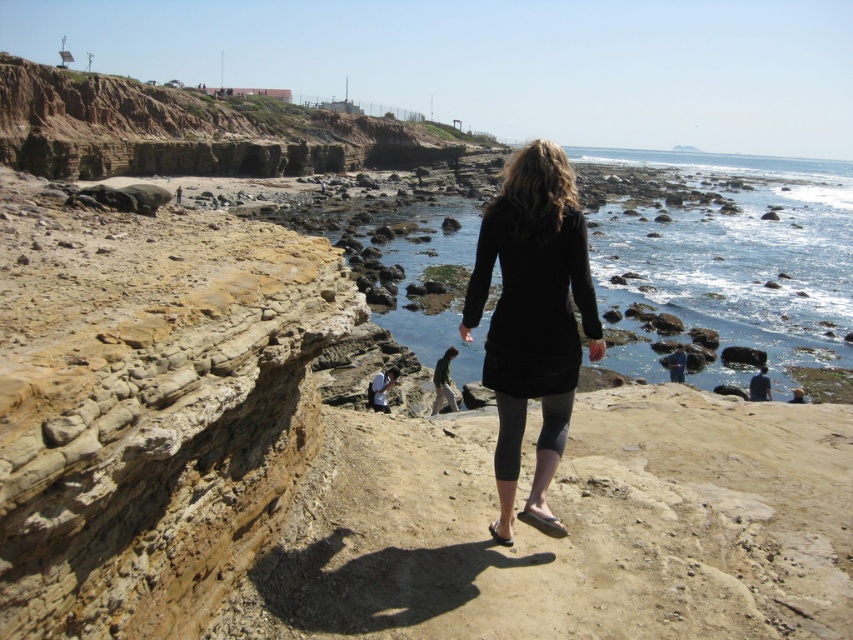
Question: Does black matte dress at center lie in front of smooth gray pants at lower right?

Choices:
 (A) yes
 (B) no

Answer: (A)

Question: Is rusty rock cliff at upper left to the right of dark green sweater at center from the viewer's perspective?

Choices:
 (A) no
 (B) yes

Answer: (A)

Question: Which point appears closest to the camera in this image?

Choices:
 (A) (442, 396)
 (B) (270, 116)

Answer: (A)

Question: Which point is closer to the camera?

Choices:
 (A) (679, 381)
 (B) (537, 273)

Answer: (B)

Question: In this image, where is dark green sweater at center located relative to dark blue fabric at lower right?

Choices:
 (A) right
 (B) left

Answer: (B)

Question: Which object is farther from the camera taking this photo?

Choices:
 (A) dark green sweater at center
 (B) white fabric at lower center
 (C) blue denim jeans at lower right
 (D) dark blue fabric at lower right

Answer: (C)